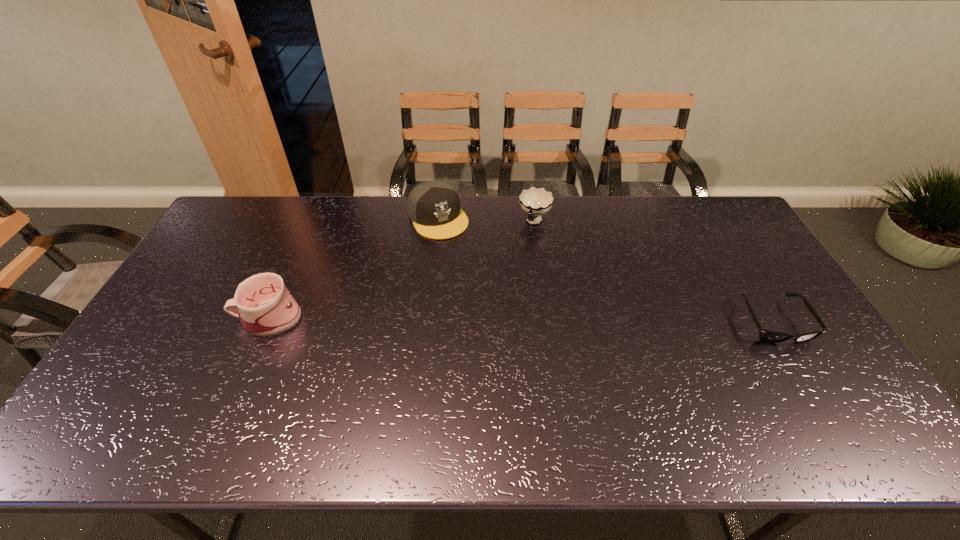
Image resolution: width=960 pixels, height=540 pixels. I want to click on empty space between the cup and the leftmost object, so click(x=401, y=270).

Where is `empty space that is in between the sunglasses and the mug`? The image size is (960, 540). empty space that is in between the sunglasses and the mug is located at coordinates (520, 320).

The width and height of the screenshot is (960, 540). Find the location of `free space between the cap and the mug`. free space between the cap and the mug is located at coordinates (353, 268).

Locate an element on the screen. Image resolution: width=960 pixels, height=540 pixels. free space between the mug and the third object from right to left is located at coordinates (353, 268).

Identify the location of the second closest object to the cap. Image resolution: width=960 pixels, height=540 pixels. (266, 308).

Select which object is the closest to the rightmost object. Please provide its 2D coordinates. Your answer should be formatted as a tuple, i.e. [(x, y)], where the tuple contains the x and y coordinates of a point satisfying the conditions above.

[(535, 202)]

Identify the location of free space that satisfies the following two spatial constraints: 1. on the front side of the cup; 2. on the left side of the cap. The width and height of the screenshot is (960, 540). (438, 222).